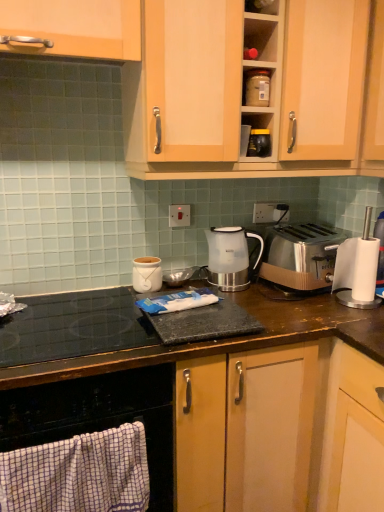
Question: Is black glass cooktop at lower left wider or thinner than wooden cabinet at upper center, which ranks as the 2th cabinetry in left-to-right order?

Choices:
 (A) wide
 (B) thin

Answer: (A)

Question: In terms of height, does black glass cooktop at lower left look taller or shorter compared to wooden cabinet at upper center, which ranks as the 2th cabinetry in left-to-right order?

Choices:
 (A) short
 (B) tall

Answer: (A)

Question: Which is farther from the black glass cooktop at lower left?

Choices:
 (A) brown wood countertop at center
 (B) wooden cabinet at upper center, which ranks as the 2th cabinetry in left-to-right order
 (C) white plastic electric outlet at center, positioned as the 1th electric outlet in front-to-back order
 (D) satin silver outlet at center, the 2th electric outlet in the front-to-back sequence
 (E) matte plastic container at upper center, marked as the 1th kitchen appliance in a top-to-bottom arrangement

Answer: (E)

Question: Estimate the real-world distances between objects in this image. Which object is closer to the matte white jar at center, which is the third kitchen appliance from top to bottom?

Choices:
 (A) satin silver toaster at right
 (B) black glass cooktop at lower left
 (C) white plastic blender at right
 (D) white glossy electric kettle at center, the second kitchen appliance positioned from the right
 (E) satin silver outlet at center, the 2th electric outlet in the front-to-back sequence

Answer: (D)